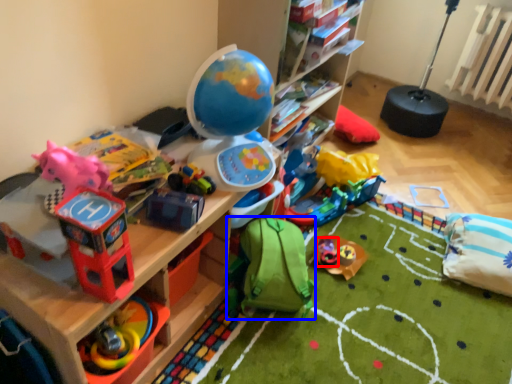
Question: Which object appears closest to the camera in this image, toy (highlighted by a red box) or toy (highlighted by a blue box)?

Choices:
 (A) toy
 (B) toy

Answer: (B)